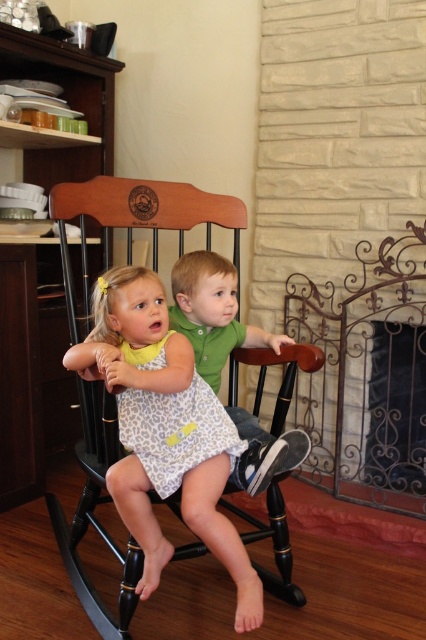
Question: Which point is farther to the camera?

Choices:
 (A) green matte shirt at center
 (B) leopard print dress at center

Answer: (A)

Question: Can you confirm if iron wrought at right is smaller than leopard print dress at center?

Choices:
 (A) yes
 (B) no

Answer: (B)

Question: Which point is closer to the camera?

Choices:
 (A) (157, 538)
 (B) (416, 253)

Answer: (A)

Question: Does iron wrought at right appear on the left side of green matte shirt at center?

Choices:
 (A) yes
 (B) no

Answer: (B)

Question: Can you confirm if iron wrought at right is positioned below leopard print dress at center?

Choices:
 (A) yes
 (B) no

Answer: (B)

Question: Which point is closer to the camera?

Choices:
 (A) (348, 378)
 (B) (181, 278)

Answer: (B)